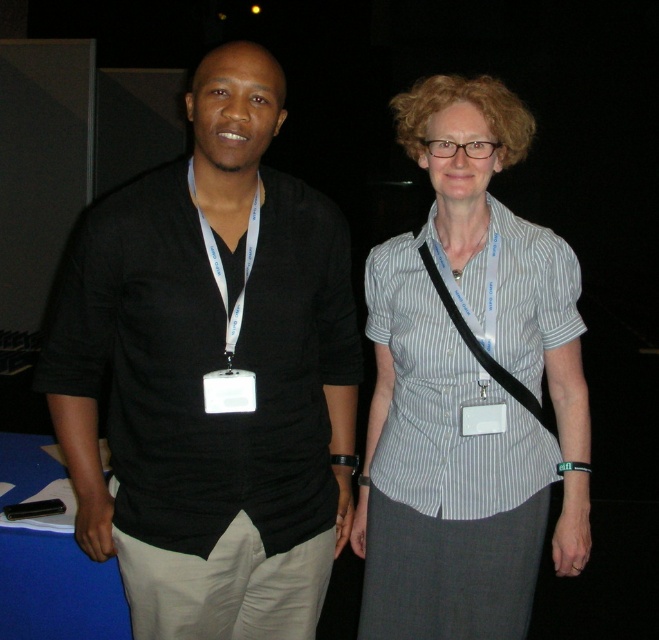
Is the position of black cotton shirt at left less distant than that of white striped shirt at center?

Yes, it is.

Is black cotton shirt at left to the right of white striped shirt at center from the viewer's perspective?

In fact, black cotton shirt at left is to the left of white striped shirt at center.

Where is `black cotton shirt at left`? The width and height of the screenshot is (659, 640). black cotton shirt at left is located at coordinates [210, 369].